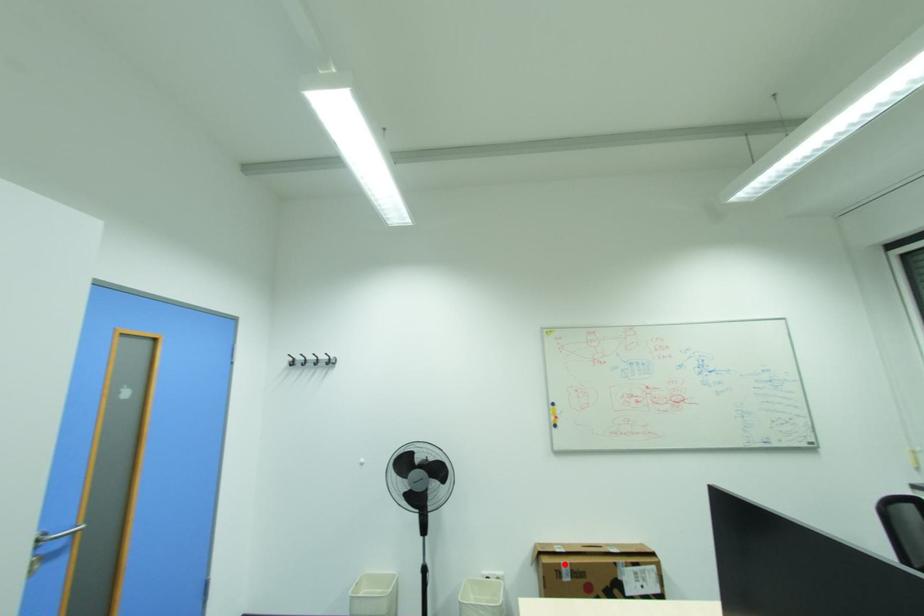
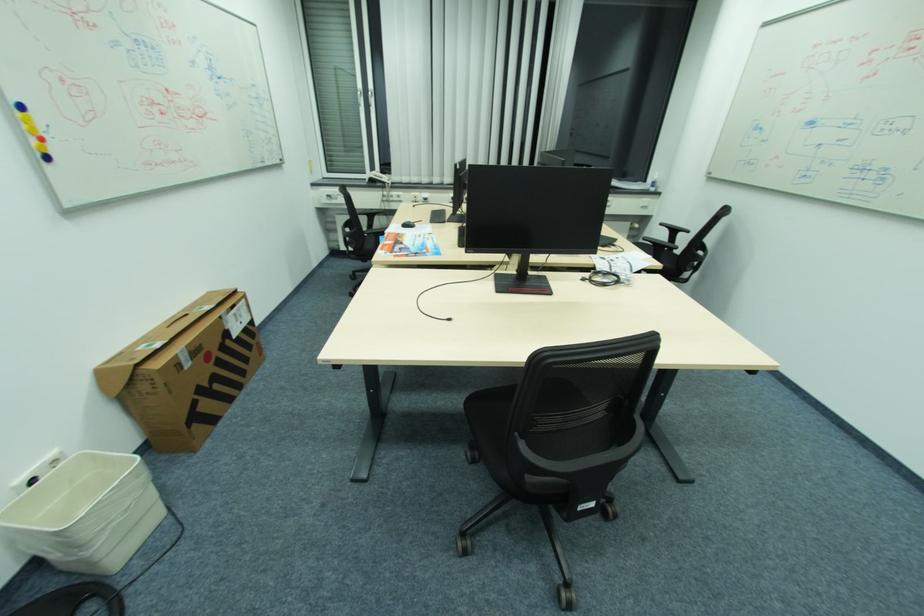
Where in the second image is the point corresponding to the highlighted location from the first image?

(181, 355)